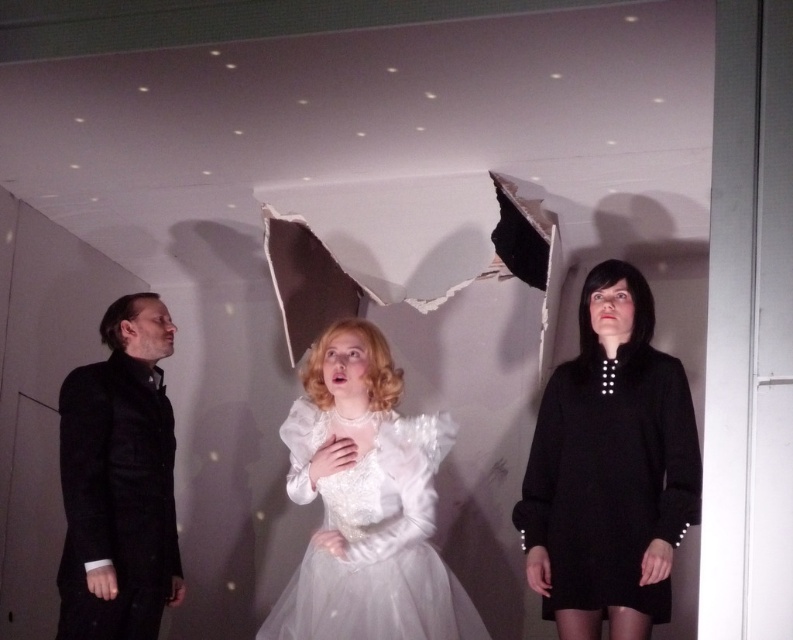
Question: Which object is the closest to the black matte dress at right?

Choices:
 (A) white tulle dress at center
 (B) black matte suit at left

Answer: (A)

Question: Which point appears farthest from the camera in this image?

Choices:
 (A) (638, 298)
 (B) (343, 602)

Answer: (A)

Question: Can you confirm if black matte suit at left is positioned to the left of white tulle dress at center?

Choices:
 (A) yes
 (B) no

Answer: (A)

Question: Which object appears closest to the camera in this image?

Choices:
 (A) black matte dress at right
 (B) black matte suit at left
 (C) white tulle dress at center

Answer: (A)

Question: Is black matte suit at left positioned behind white tulle dress at center?

Choices:
 (A) no
 (B) yes

Answer: (B)

Question: Does black matte suit at left have a greater width compared to white tulle dress at center?

Choices:
 (A) yes
 (B) no

Answer: (B)